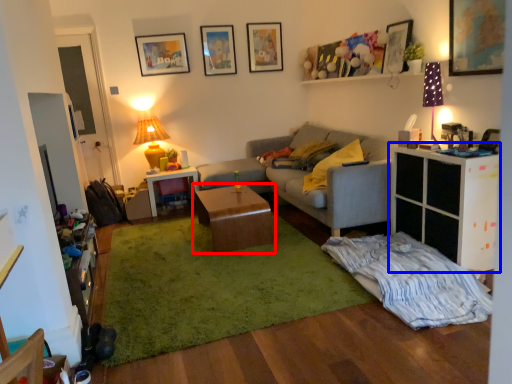
Question: Which object is closer to the camera taking this photo, table (highlighted by a red box) or cabinetry (highlighted by a blue box)?

Choices:
 (A) table
 (B) cabinetry

Answer: (B)